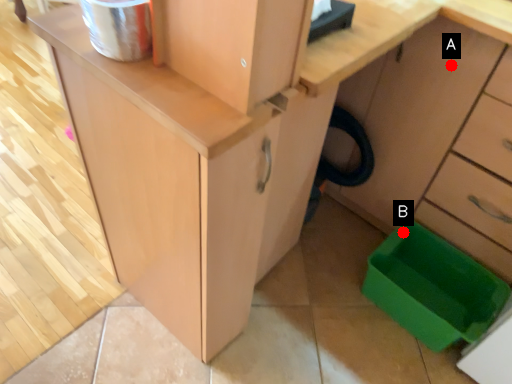
Question: Two points are circled on the image, labeled by A and B beside each circle. Which point appears closest to the camera in this image?

Choices:
 (A) A is closer
 (B) B is closer

Answer: (A)